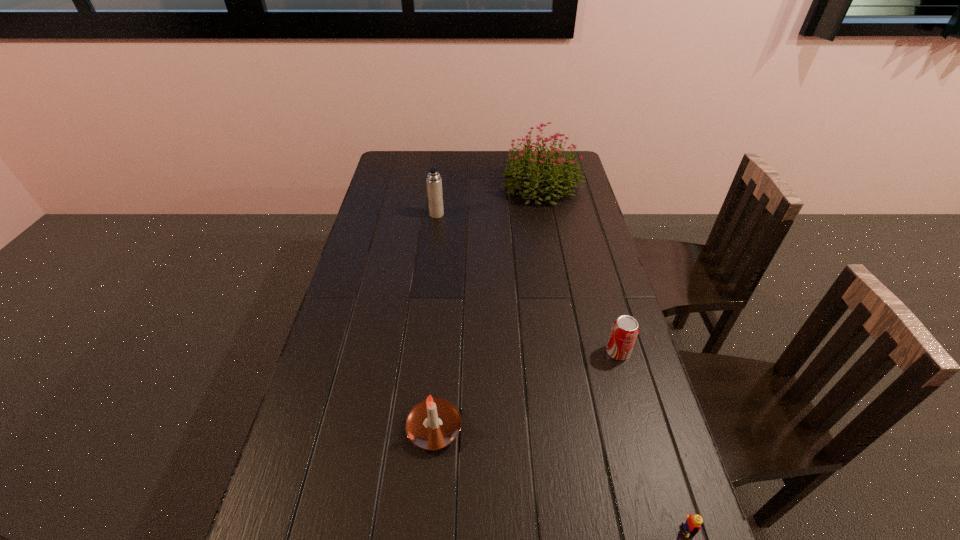
The image size is (960, 540). What are the coordinates of `the farthest object` in the screenshot? It's located at (555, 177).

What are the coordinates of `the tallest object` in the screenshot? It's located at (555, 177).

The height and width of the screenshot is (540, 960). Find the location of `thermos bottle`. thermos bottle is located at coordinates (434, 182).

At what (x,y) coordinates should I click in order to perform the action: click on the second tallest object. Please return your answer as a coordinate pair (x, y). Looking at the image, I should click on (434, 182).

Locate an element on the screen. The image size is (960, 540). the second nearest object is located at coordinates (432, 424).

The height and width of the screenshot is (540, 960). I want to click on the third farthest object, so click(x=625, y=329).

You are a GUI agent. You are given a task and a screenshot of the screen. Output one action in this format:
    pyautogui.click(x=<x>, y=<y>)
    Task: Click on the soda can
    The width and height of the screenshot is (960, 540).
    Given the screenshot: What is the action you would take?
    pyautogui.click(x=625, y=329)

Where is `free space located 0.340m on the left of the farthest object`? free space located 0.340m on the left of the farthest object is located at coordinates (419, 185).

Where is `vacant space situated on the back of the second tallest object`? vacant space situated on the back of the second tallest object is located at coordinates (438, 203).

Locate an element on the screen. The height and width of the screenshot is (540, 960). free space located on the left of the candle is located at coordinates (365, 428).